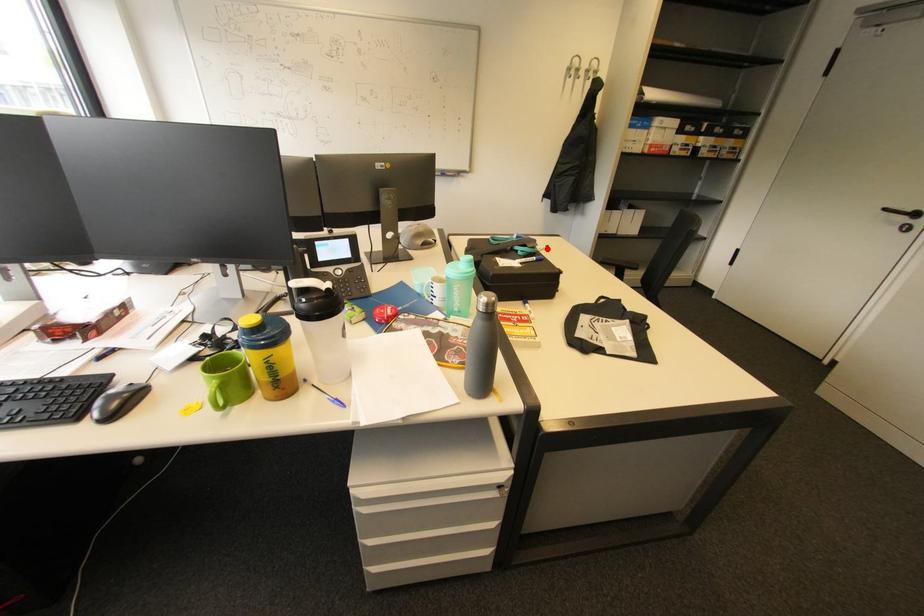
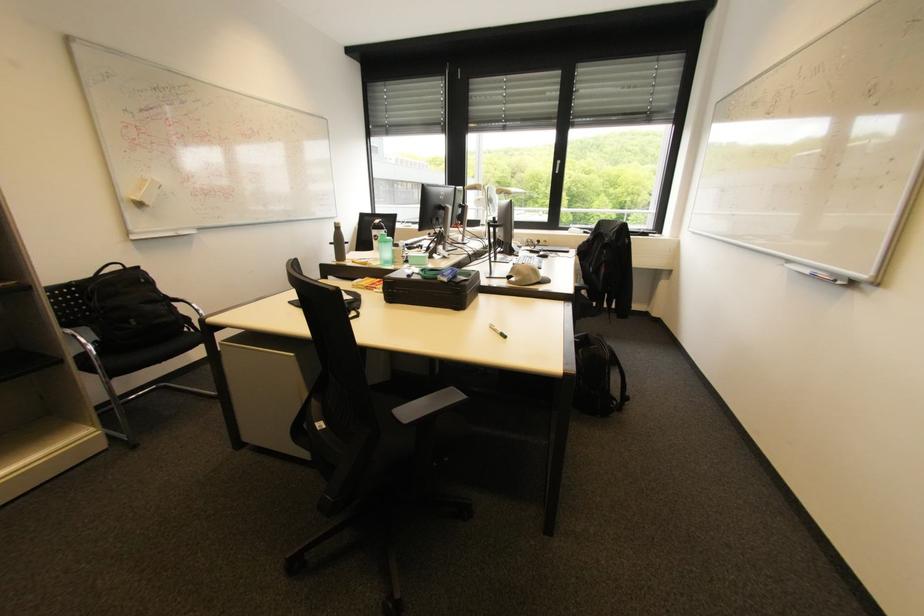
Question: I am providing you with two images of the same scene from different viewpoints. In image1, a red point is highlighted. Considering the same 3D point in image2, which of the following is correct?

Choices:
 (A) It is closer
 (B) It is farther

Answer: (A)